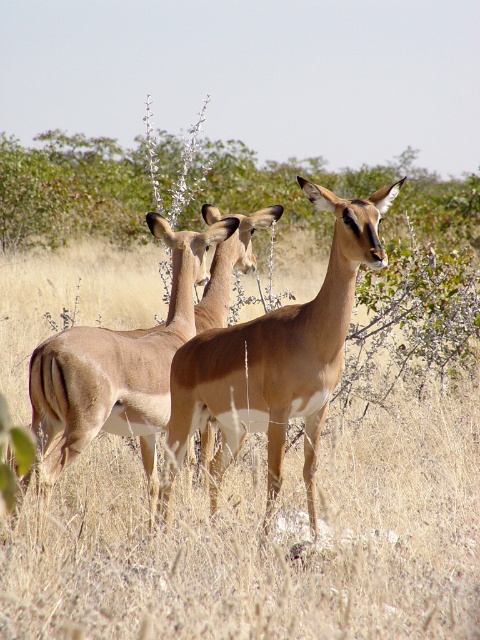
You are an animal tracker observing the impalas in the dry grassland. You notice the brown dry grass at center and the light brown fur at center. Which object is positioned higher in the scene?

The brown dry grass at center is located above the light brown fur at center, so it is positioned higher in the scene.

You are a photographer trying to capture the light brown fur antelope at center. You notice the brown dry grass at center in the foreground. Will the grass block the antelope in your photo if you keep the current framing?

The brown dry grass at center might be wider than the light brown fur antelope at center, so there is a possibility that the grass could block the antelope in the photo if they are positioned similarly in width and the grass is in the foreground.